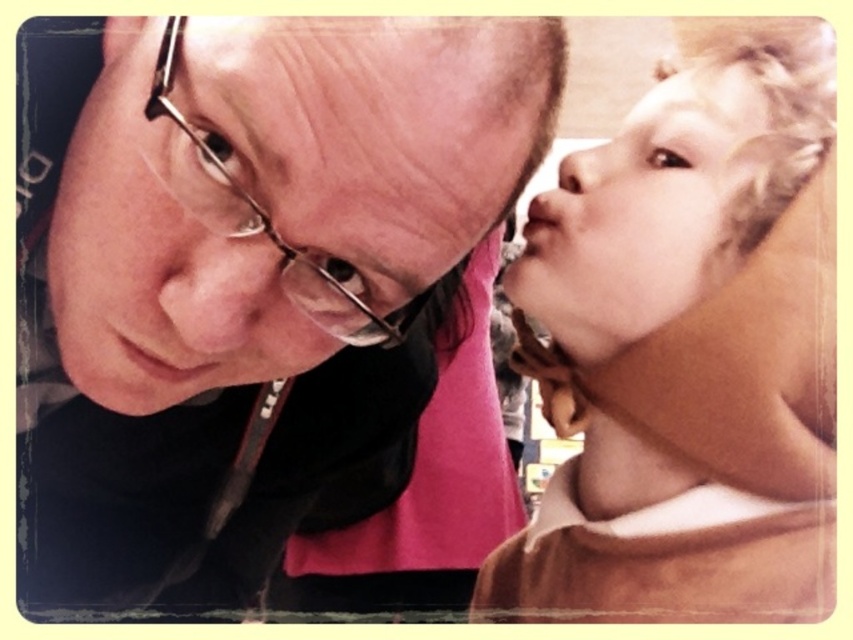
Is matte black glasses at upper left taller than metallic frame glasses at upper left?

Correct, matte black glasses at upper left is much taller as metallic frame glasses at upper left.

Is matte black glasses at upper left closer to camera compared to metallic frame glasses at upper left?

Yes, it is.

Which is behind, point (206, 278) or point (357, 316)?

The point (357, 316) is behind.

Find the location of `matte black glasses at upper left`. matte black glasses at upper left is located at coordinates (254, 285).

Does blonde hair at right lie in front of smooth skin nose at upper right?

That is True.

Find the location of a particular element. The image size is (853, 640). blonde hair at right is located at coordinates (645, 216).

Find the location of a particular element. The image size is (853, 640). blonde hair at right is located at coordinates (645, 216).

Who is shorter, blonde hair at upper right or metallic frame glasses at upper left?

metallic frame glasses at upper left is shorter.

Which is more to the right, blonde hair at upper right or metallic frame glasses at upper left?

blonde hair at upper right is more to the right.

Who is more distant from viewer, (695, 141) or (225, 195)?

Point (695, 141)

This screenshot has height=640, width=853. What are the coordinates of `blonde hair at upper right` in the screenshot? It's located at (692, 348).